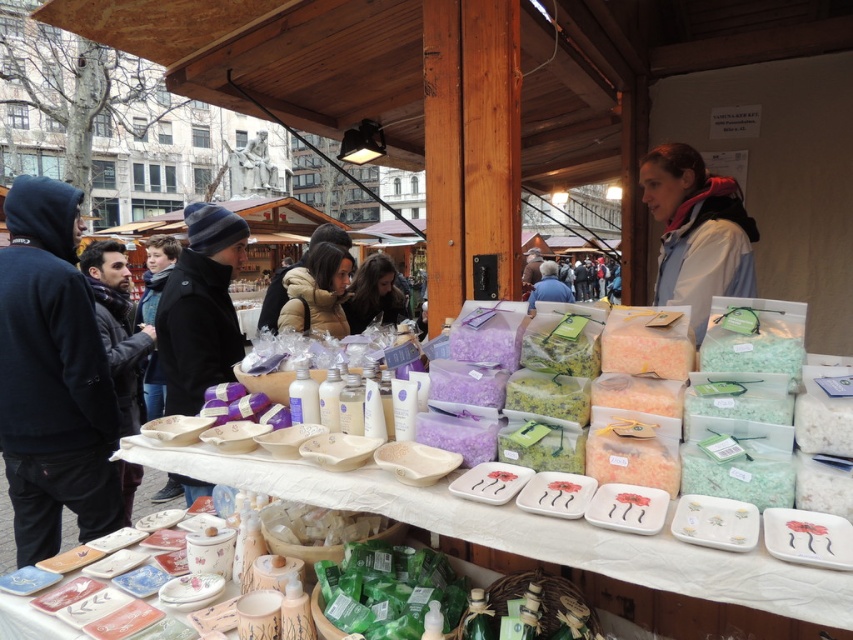
Question: Based on their relative distances, which object is nearer to the gray fleece jacket at upper right?

Choices:
 (A) puffy white jacket at center
 (B) black hoodie at left

Answer: (A)

Question: Among these objects, which one is farthest from the camera?

Choices:
 (A) white ceramic trays at center
 (B) black hoodie at left
 (C) puffy white jacket at center

Answer: (C)

Question: Considering the relative positions of black hoodie at left and black wool coat at left in the image provided, where is black hoodie at left located with respect to black wool coat at left?

Choices:
 (A) below
 (B) above

Answer: (A)

Question: Can you confirm if white ceramic trays at center is smaller than puffy white jacket at center?

Choices:
 (A) yes
 (B) no

Answer: (B)

Question: Is black wool coat at left thinner than puffy white jacket at center?

Choices:
 (A) yes
 (B) no

Answer: (B)

Question: Which point appears closest to the camera in this image?

Choices:
 (A) (178, 408)
 (B) (538, 288)
 (C) (694, 195)
 (D) (99, 515)

Answer: (C)